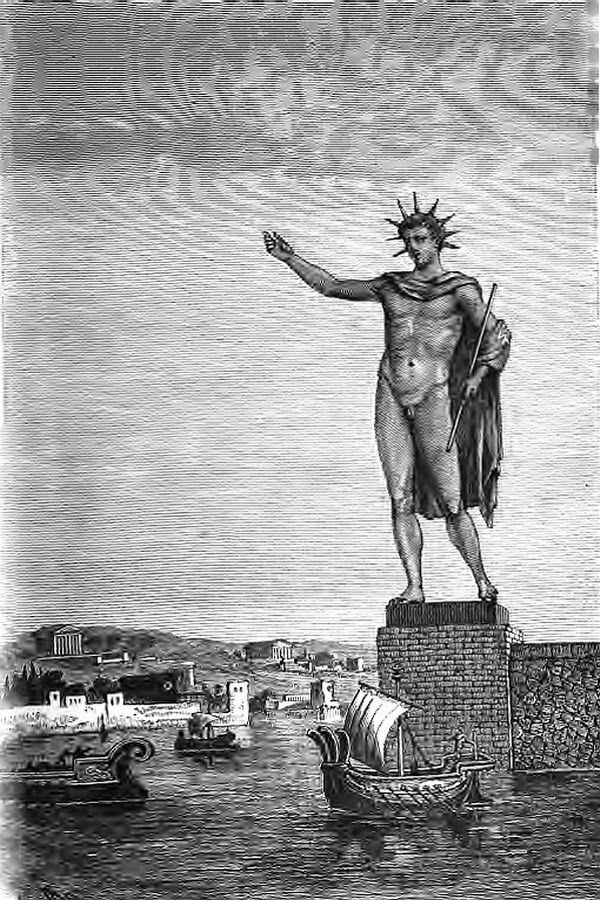
Identify the location of statue of naked man. This screenshot has width=600, height=900. (480, 559).